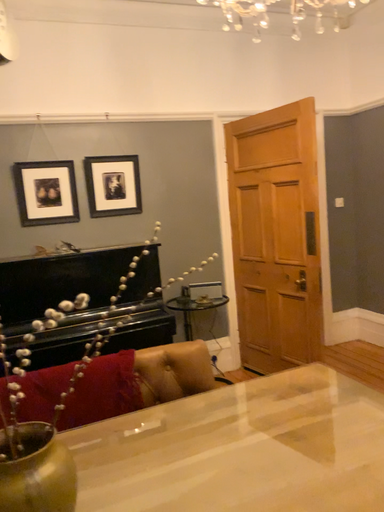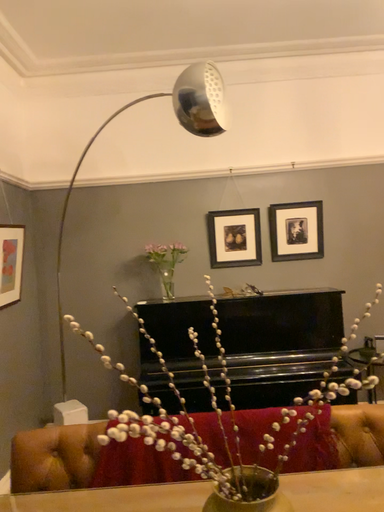
Question: How did the camera likely rotate when shooting the video?

Choices:
 (A) rotated left
 (B) rotated right

Answer: (A)